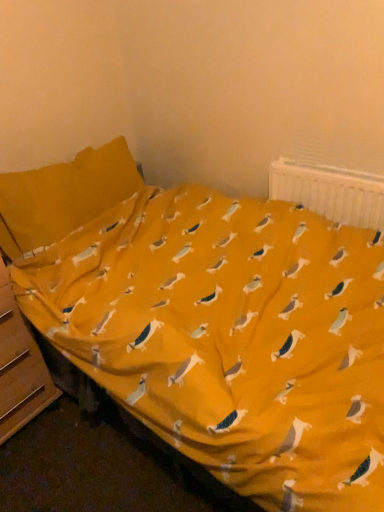
Measure the distance between wooden file cabinet at lower left and camera.

wooden file cabinet at lower left and camera are 4.51 feet apart.

What do you see at coordinates (19, 367) in the screenshot?
I see `wooden file cabinet at lower left` at bounding box center [19, 367].

The image size is (384, 512). Identify the location of wooden file cabinet at lower left. (19, 367).

Locate an element on the screen. The image size is (384, 512). white plastic radiator at upper right is located at coordinates pyautogui.click(x=330, y=191).

What do you see at coordinates (330, 191) in the screenshot? The height and width of the screenshot is (512, 384). I see `white plastic radiator at upper right` at bounding box center [330, 191].

This screenshot has height=512, width=384. What are the coordinates of `wooden file cabinet at lower left` in the screenshot? It's located at (19, 367).

Is wooden file cabinet at lower left at the right side of white plastic radiator at upper right?

No, wooden file cabinet at lower left is not to the right of white plastic radiator at upper right.

In the image, is wooden file cabinet at lower left positioned in front of or behind white plastic radiator at upper right?

Visually, wooden file cabinet at lower left is located in front of white plastic radiator at upper right.

Is point (4, 372) farther from camera compared to point (357, 222)?

No, (4, 372) is in front of (357, 222).

From the image's perspective, which one is positioned higher, wooden file cabinet at lower left or white plastic radiator at upper right?

white plastic radiator at upper right.

From a real-world perspective, which object stands above the other?

In real-world perspective, white plastic radiator at upper right is above.

Considering the sizes of objects wooden file cabinet at lower left and white plastic radiator at upper right in the image provided, who is wider, wooden file cabinet at lower left or white plastic radiator at upper right?

wooden file cabinet at lower left is wider.

Who is taller, wooden file cabinet at lower left or white plastic radiator at upper right?

wooden file cabinet at lower left.

Does wooden file cabinet at lower left have a larger size compared to white plastic radiator at upper right?

Yes.

Is wooden file cabinet at lower left inside or outside of white plastic radiator at upper right?

wooden file cabinet at lower left is spatially situated outside white plastic radiator at upper right.

Is the surface of wooden file cabinet at lower left in direct contact with white plastic radiator at upper right?

No, wooden file cabinet at lower left is not next to white plastic radiator at upper right.

Is wooden file cabinet at lower left positioned with its back to white plastic radiator at upper right?

No, wooden file cabinet at lower left is not facing away from white plastic radiator at upper right.

Measure the distance between wooden file cabinet at lower left and white plastic radiator at upper right.

wooden file cabinet at lower left and white plastic radiator at upper right are 3.81 feet apart.

Where is `radiator above the wooden file cabinet at lower left (from the image's perspective)`? The width and height of the screenshot is (384, 512). radiator above the wooden file cabinet at lower left (from the image's perspective) is located at coordinates (330, 191).

Would you say white plastic radiator at upper right is to the left or to the right of wooden file cabinet at lower left in the picture?

white plastic radiator at upper right is positioned on wooden file cabinet at lower left's right side.

Considering the relative positions of white plastic radiator at upper right and wooden file cabinet at lower left in the image provided, is white plastic radiator at upper right behind wooden file cabinet at lower left?

Yes.

Does point (336, 219) appear closer or farther from the camera than point (57, 396)?

Point (336, 219).

From the image's perspective, which object appears higher, white plastic radiator at upper right or wooden file cabinet at lower left?

From the image's view, white plastic radiator at upper right is above.

From a real-world perspective, is white plastic radiator at upper right positioned under wooden file cabinet at lower left based on gravity?

No, from a real-world perspective, white plastic radiator at upper right is not below wooden file cabinet at lower left.

Based on the photo, does white plastic radiator at upper right have a greater width compared to wooden file cabinet at lower left?

No, white plastic radiator at upper right is not wider than wooden file cabinet at lower left.

Considering the sizes of objects white plastic radiator at upper right and wooden file cabinet at lower left in the image provided, who is taller, white plastic radiator at upper right or wooden file cabinet at lower left?

wooden file cabinet at lower left.

Considering the sizes of objects white plastic radiator at upper right and wooden file cabinet at lower left in the image provided, who is bigger, white plastic radiator at upper right or wooden file cabinet at lower left?

Bigger between the two is wooden file cabinet at lower left.

Would you say white plastic radiator at upper right is outside wooden file cabinet at lower left?

Yes, white plastic radiator at upper right is located beyond the bounds of wooden file cabinet at lower left.

Can you see white plastic radiator at upper right touching wooden file cabinet at lower left?

No, white plastic radiator at upper right is not touching wooden file cabinet at lower left.

Is white plastic radiator at upper right positioned with its back to wooden file cabinet at lower left?

white plastic radiator at upper right is not turned away from wooden file cabinet at lower left.

The height and width of the screenshot is (512, 384). I want to click on radiator lying behind the wooden file cabinet at lower left, so click(330, 191).

This screenshot has width=384, height=512. What are the coordinates of `radiator that appears above the wooden file cabinet at lower left (from the image's perspective)` in the screenshot? It's located at (330, 191).

Identify the location of file cabinet directly beneath the white plastic radiator at upper right (from a real-world perspective). (19, 367).